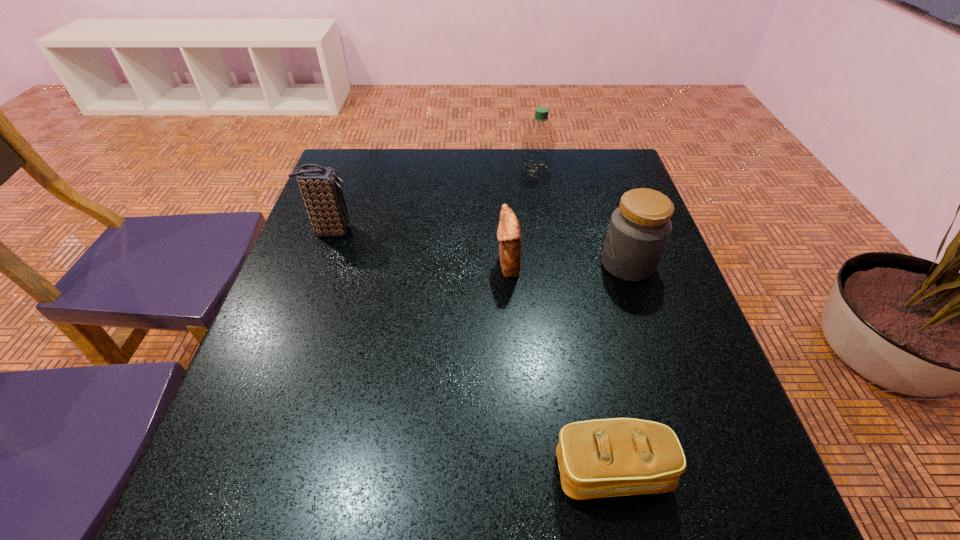
At what (x,y) coordinates should I click in order to perform the action: click on free spot located on the surface of the jar near the warning symbol. Please return your answer as a coordinate pair (x, y). The image size is (960, 540). Looking at the image, I should click on (457, 264).

Find the location of a particular element. The image size is (960, 540). free space located on the surface of the jar near the warning symbol is located at coordinates (448, 264).

I want to click on vacant space located 0.220m on the surface of the jar near the warning symbol, so click(x=505, y=264).

What are the coordinates of `free region located on the open side of the second clutch bag from right to left` in the screenshot? It's located at (369, 265).

This screenshot has width=960, height=540. Find the location of `free spot located on the open side of the second clutch bag from right to left`. free spot located on the open side of the second clutch bag from right to left is located at coordinates (321, 265).

Find the location of a particular element. The image size is (960, 540). vacant space located 0.270m on the open side of the second clutch bag from right to left is located at coordinates (377, 265).

Locate an element on the screen. Image resolution: width=960 pixels, height=540 pixels. object that is at the far edge is located at coordinates (538, 142).

Where is `object at the near edge`? The image size is (960, 540). object at the near edge is located at coordinates (600, 458).

This screenshot has width=960, height=540. In order to click on object that is at the left edge in this screenshot , I will do `click(321, 189)`.

The height and width of the screenshot is (540, 960). Find the location of `jar that is at the right edge`. jar that is at the right edge is located at coordinates (639, 229).